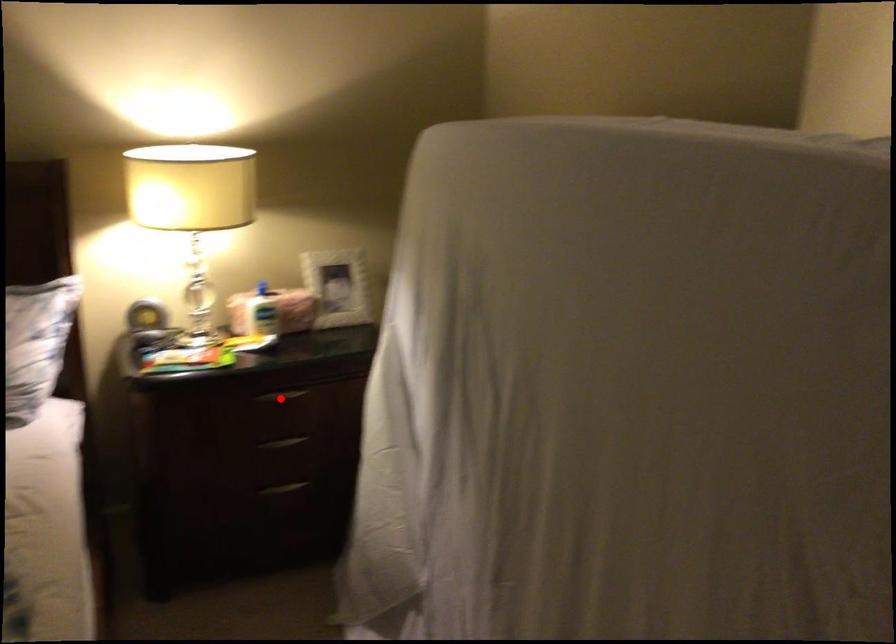
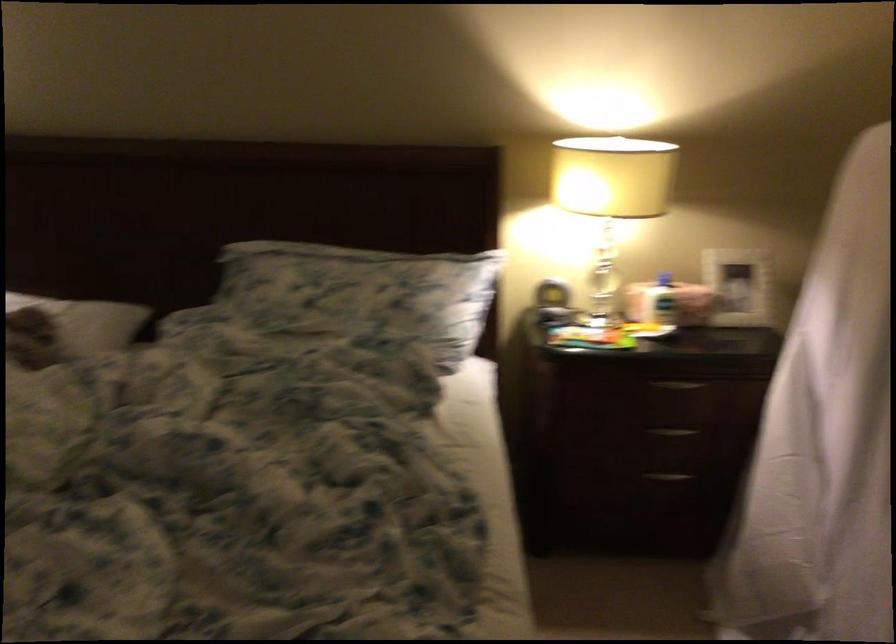
Locate, in the second image, the point that corresponds to the highlighted location in the first image.

(679, 384)